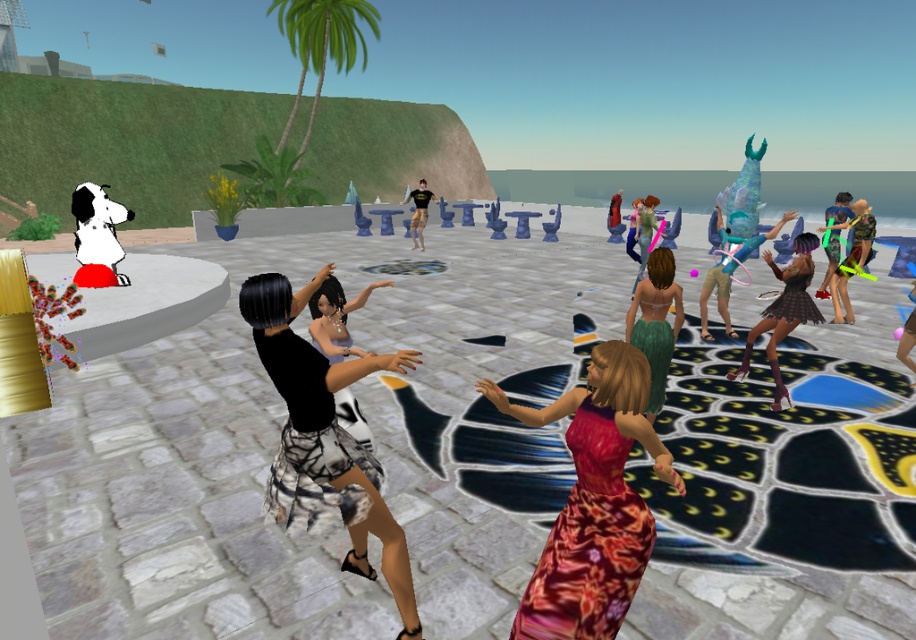
You are navigating through a virtual environment and need to determine the shortest path between two points. The first point is labeled as point [736,253] and the second is point [608,241]. Based on their positions, which point is closer to your current position as you look at the scene?

Point [736,253] is closer to the viewer than point [608,241], so the shortest path would start from the closer point [736,253].

You are an avatar at the party and want to introduce yourself to both the teal fabric dress at center and the matte green dress at center. Which one should you approach first if you want to greet the person on the left side first?

The teal fabric dress at center is positioned on the right side of matte green dress at center, so you should approach the matte green dress at center first as it is on the left side.